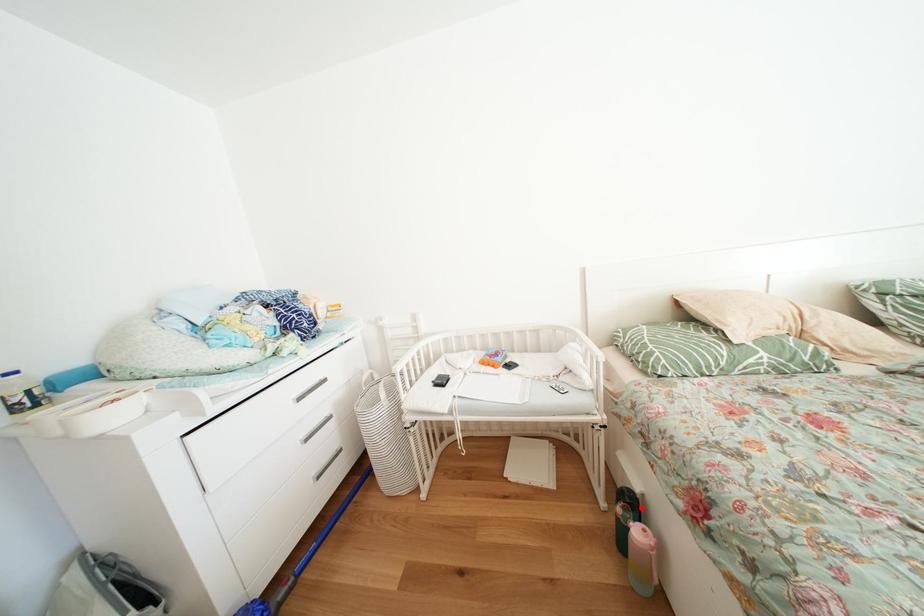
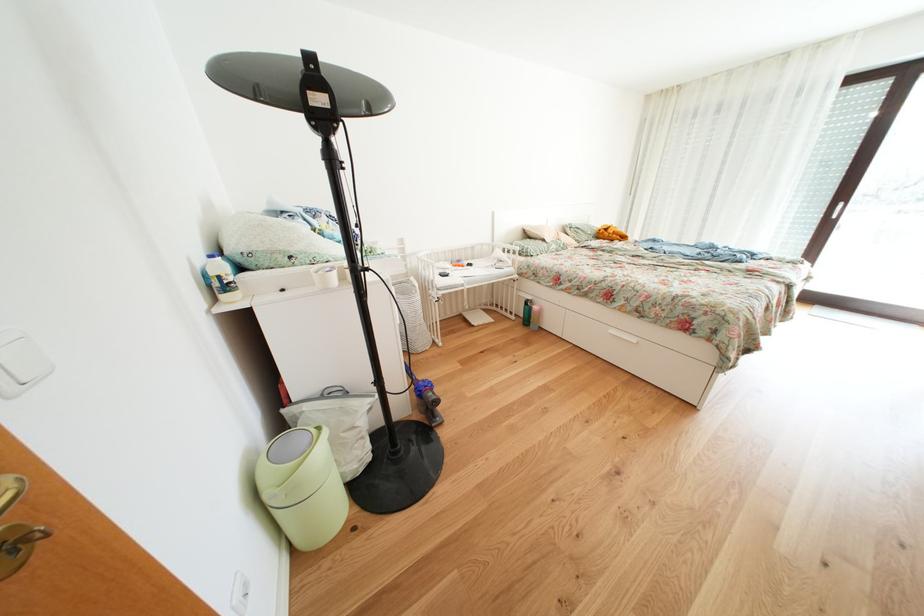
The point at the highlighted location is marked in the first image. Where is the corresponding point in the second image?

(541, 307)